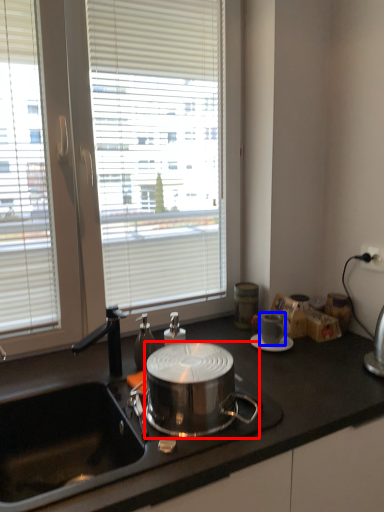
Question: Which object is further to the camera taking this photo, kitchen appliance (highlighted by a red box) or coffee cup (highlighted by a blue box)?

Choices:
 (A) kitchen appliance
 (B) coffee cup

Answer: (B)